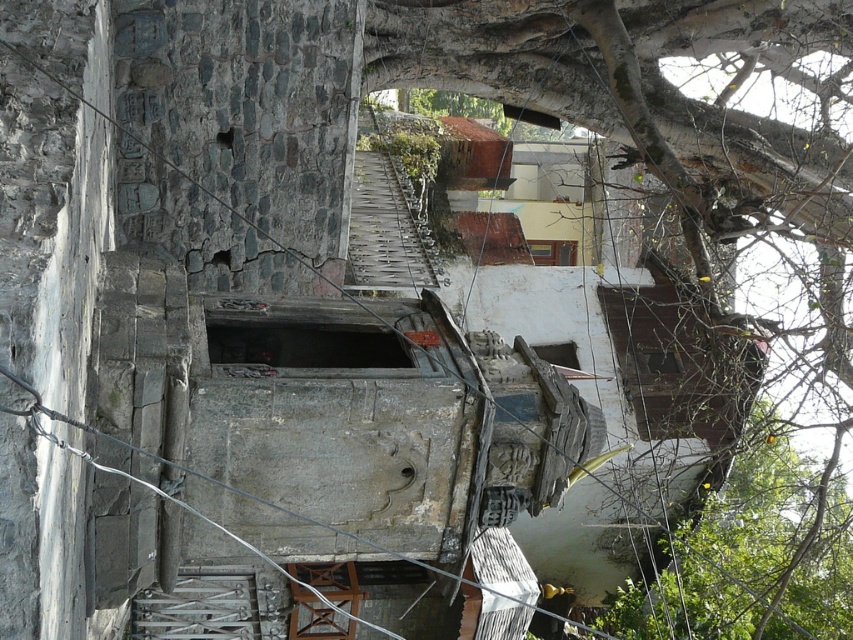
Is metallic wrought iron stairs at lower center shorter than wooden stool at center?

Yes.

How much distance is there between metallic wrought iron stairs at lower center and wooden stool at center?

The distance of metallic wrought iron stairs at lower center from wooden stool at center is 1.38 meters.

Is point (183, 604) farther from camera compared to point (310, 621)?

That is True.

Image resolution: width=853 pixels, height=640 pixels. What are the coordinates of `metallic wrought iron stairs at lower center` in the screenshot? It's located at (199, 605).

Is the position of green leafy tree at upper right more distant than that of wooden stool at center?

No, it is not.

Between point (509, 102) and point (306, 605), which one is positioned in front?

Point (306, 605) is in front.

Which is in front, point (692, 305) or point (337, 620)?

Point (337, 620) is in front.

You are a GUI agent. You are given a task and a screenshot of the screen. Output one action in this format:
    pyautogui.click(x=<x>, y=<y>)
    Task: Click on the green leafy tree at upper right
    The height and width of the screenshot is (640, 853).
    Given the screenshot: What is the action you would take?
    pyautogui.click(x=665, y=122)

Consider the image. Is green leafy tree at upper right taller than metallic wrought iron stairs at lower center?

Indeed, green leafy tree at upper right has a greater height compared to metallic wrought iron stairs at lower center.

Which is above, green leafy tree at upper right or metallic wrought iron stairs at lower center?

green leafy tree at upper right is higher up.

Who is more forward, (485, 45) or (175, 634)?

Point (485, 45) is more forward.

I want to click on green leafy tree at upper right, so click(665, 122).